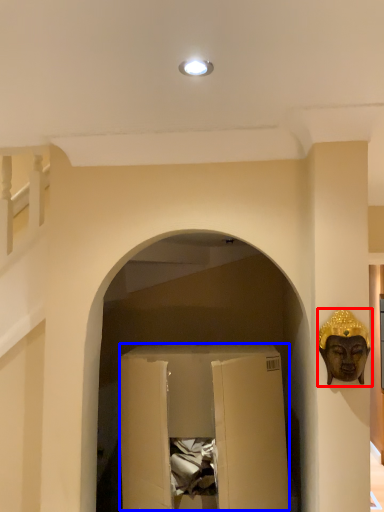
Question: Which of the following is the closest to the observer, person (highlighted by a red box) or wide (highlighted by a blue box)?

Choices:
 (A) person
 (B) wide

Answer: (A)